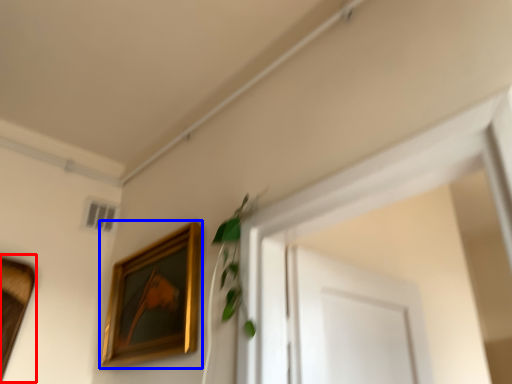
Question: Among these objects, which one is nearest to the camera, picture frame (highlighted by a red box) or picture frame (highlighted by a blue box)?

Choices:
 (A) picture frame
 (B) picture frame

Answer: (B)